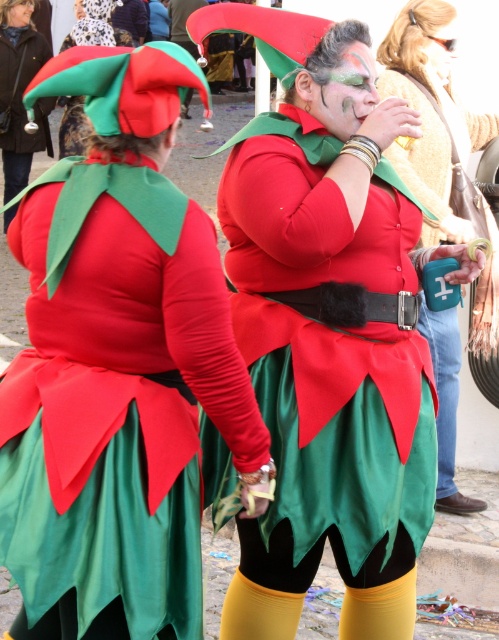
Who is shorter, matte green fabric hat at upper left or green satin skirt at lower center?

green satin skirt at lower center

Does matte green fabric hat at upper left have a greater height compared to green satin skirt at lower center?

Yes, matte green fabric hat at upper left is taller than green satin skirt at lower center.

Based on the photo, who is more distant from viewer, (50,54) or (444,337)?

The point (50,54) is behind.

Locate an element on the screen. This screenshot has height=640, width=499. matte green fabric hat at upper left is located at coordinates (19, 99).

From the picture: Which is more to the right, matte green face paint at center or green satin skirt at lower center?

green satin skirt at lower center

Which is above, matte green face paint at center or green satin skirt at lower center?

matte green face paint at center is higher up.

This screenshot has height=640, width=499. Identify the location of matte green face paint at center. (343, 92).

Is point (53, 340) closer to viewer compared to point (410, 90)?

That is True.

Does matte fabric elf costume at center come in front of matte plastic cup at center?

That is True.

Between point (158, 419) and point (457, 392), which one is positioned in front?

Point (158, 419) is more forward.

At what (x,y) coordinates should I click in order to perform the action: click on matte fabric elf costume at center. Please return your answer as a coordinate pair (x, y). The height and width of the screenshot is (640, 499). Looking at the image, I should click on (119, 355).